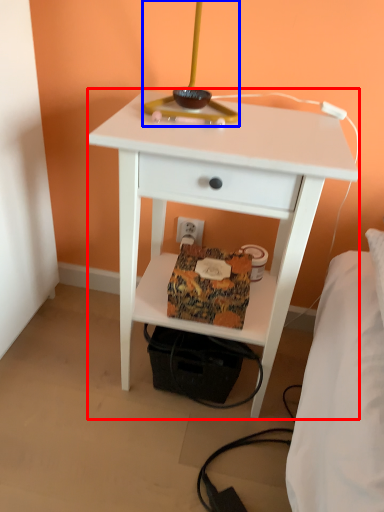
Question: Which object appears closest to the camera in this image, nightstand (highlighted by a red box) or table lamp (highlighted by a blue box)?

Choices:
 (A) nightstand
 (B) table lamp

Answer: (B)